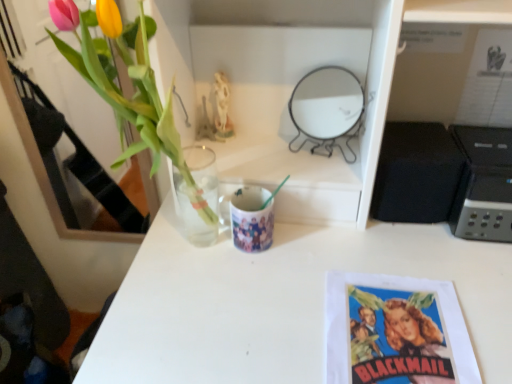
Question: Considering the relative sizes of printed paper poster at lower right and black matte speaker at right in the image provided, is printed paper poster at lower right thinner than black matte speaker at right?

Choices:
 (A) no
 (B) yes

Answer: (A)

Question: Considering the relative positions of printed paper poster at lower right and black matte speaker at right in the image provided, is printed paper poster at lower right in front of black matte speaker at right?

Choices:
 (A) yes
 (B) no

Answer: (A)

Question: Can you confirm if printed paper poster at lower right is bigger than black matte speaker at right?

Choices:
 (A) yes
 (B) no

Answer: (B)

Question: Is printed paper poster at lower right with black matte speaker at right?

Choices:
 (A) yes
 (B) no

Answer: (B)

Question: Is printed paper poster at lower right outside black matte speaker at right?

Choices:
 (A) yes
 (B) no

Answer: (A)

Question: Is printed paper poster at lower right facing towards black matte speaker at right?

Choices:
 (A) no
 (B) yes

Answer: (A)

Question: Is black matte speaker at right aimed at black plastic printer at right?

Choices:
 (A) no
 (B) yes

Answer: (A)

Question: Can you confirm if black matte speaker at right is taller than black plastic printer at right?

Choices:
 (A) no
 (B) yes

Answer: (A)

Question: Considering the relative sizes of black matte speaker at right and black plastic printer at right in the image provided, is black matte speaker at right thinner than black plastic printer at right?

Choices:
 (A) no
 (B) yes

Answer: (B)

Question: Is black matte speaker at right looking in the opposite direction of black plastic printer at right?

Choices:
 (A) no
 (B) yes

Answer: (A)

Question: Is black matte speaker at right bigger than black plastic printer at right?

Choices:
 (A) no
 (B) yes

Answer: (A)

Question: Is black matte speaker at right not near black plastic printer at right?

Choices:
 (A) yes
 (B) no

Answer: (B)

Question: Could you tell me if translucent glass vase at upper left is turned towards printed paper poster at lower right?

Choices:
 (A) no
 (B) yes

Answer: (A)